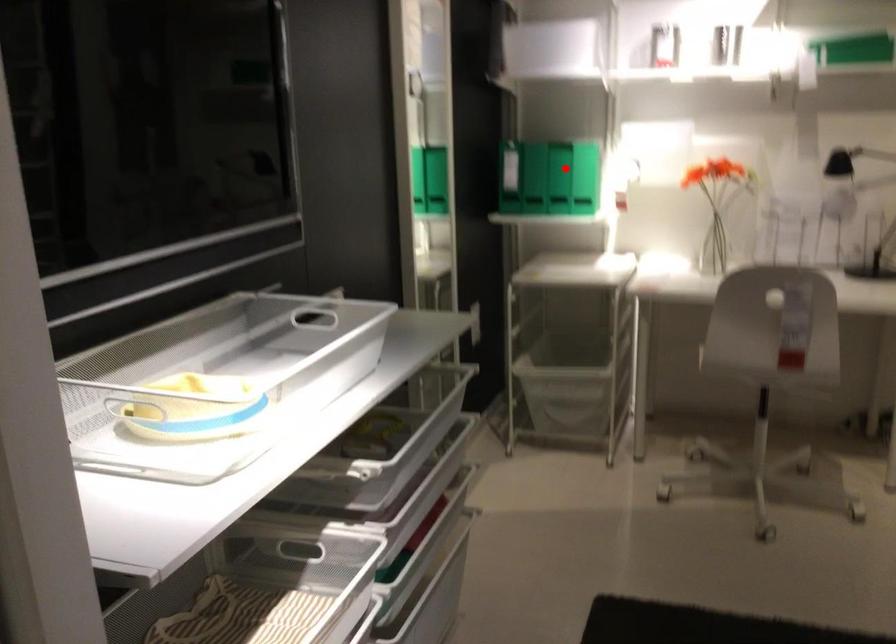
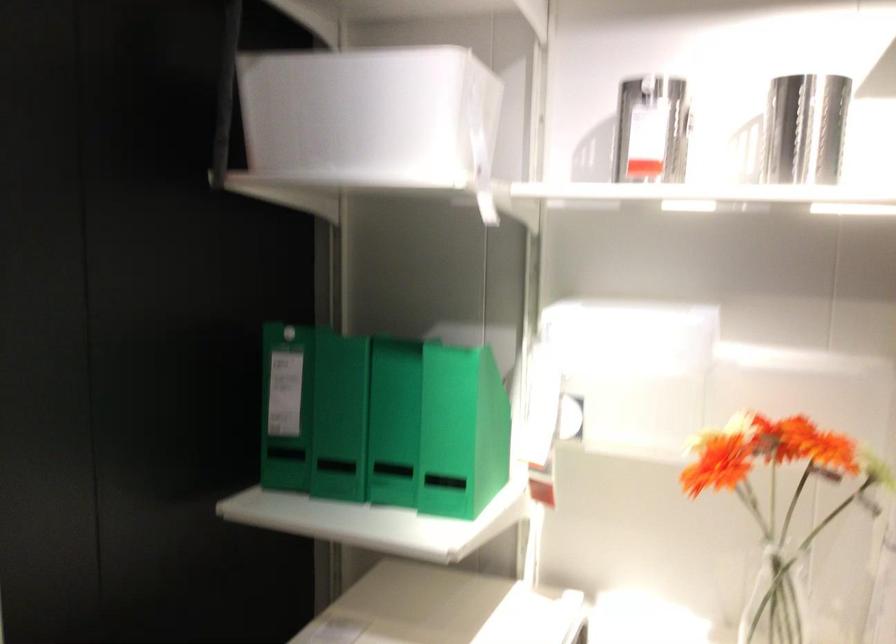
Question: I am providing you with two images of the same scene from different viewpoints. Given a red point in image1, look at the same physical point in image2. Is it:

Choices:
 (A) Closer to the viewpoint
 (B) Farther from the viewpoint

Answer: (A)